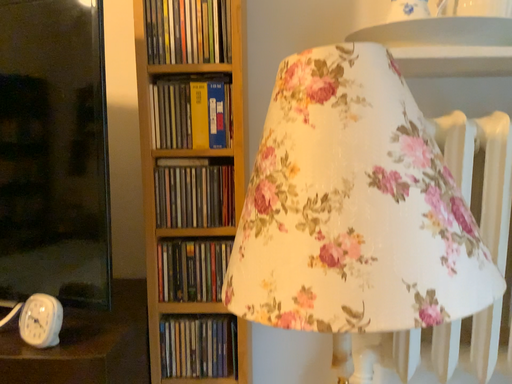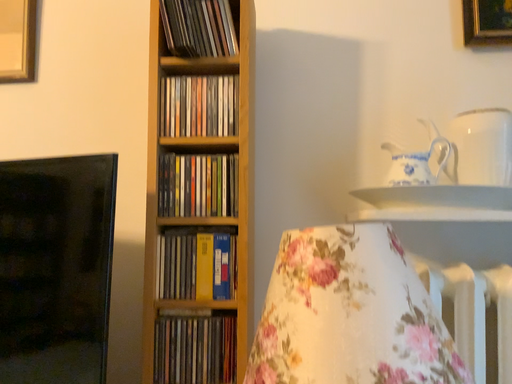
Question: How did the camera likely rotate when shooting the video?

Choices:
 (A) rotated upward
 (B) rotated downward

Answer: (A)